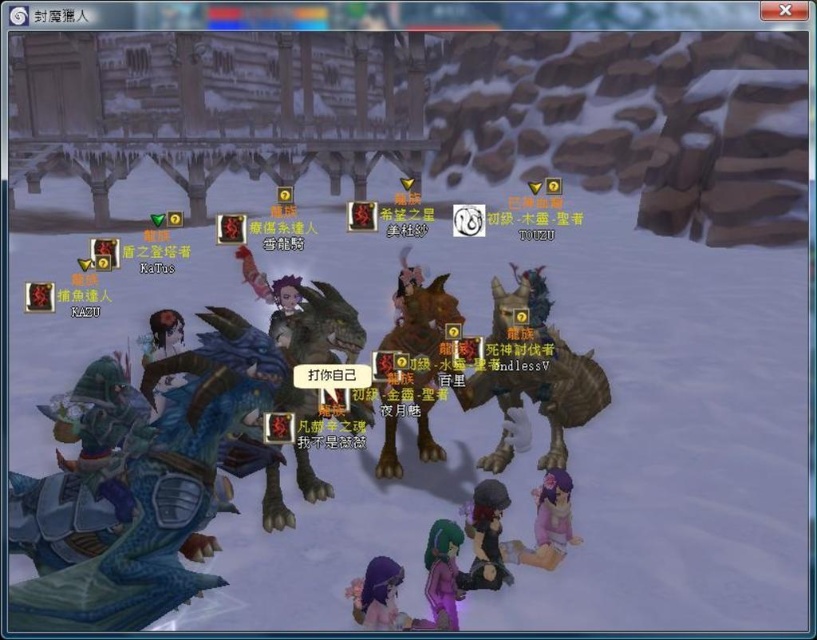
Who is more distant from viewer, [161,472] or [435,291]?

The point [435,291] is behind.

Describe the element at coordinates (163, 488) in the screenshot. I see `blue metallic dragon at left` at that location.

Between point (166, 474) and point (396, 468), which one is positioned behind?

The point (396, 468) is behind.

This screenshot has width=817, height=640. In order to click on blue metallic dragon at left in this screenshot , I will do (163, 488).

Which is more to the right, brown matte creature at right or brown furry creature at center?

Positioned to the right is brown matte creature at right.

Can you confirm if brown matte creature at right is smaller than brown furry creature at center?

No.

Does point (579, 369) come in front of point (426, 429)?

Yes.

Where is `brown matte creature at right`? brown matte creature at right is located at coordinates [x=534, y=365].

In the scene shown: Is blue metallic dragon at left to the left of brown matte creature at right from the viewer's perspective?

Correct, you'll find blue metallic dragon at left to the left of brown matte creature at right.

How far apart are blue metallic dragon at left and brown matte creature at right?

blue metallic dragon at left and brown matte creature at right are 4.63 feet apart from each other.

Which is in front, point (161, 592) or point (502, 432)?

Point (161, 592) is in front.

Locate an element on the screen. This screenshot has width=817, height=640. blue metallic dragon at left is located at coordinates (163, 488).